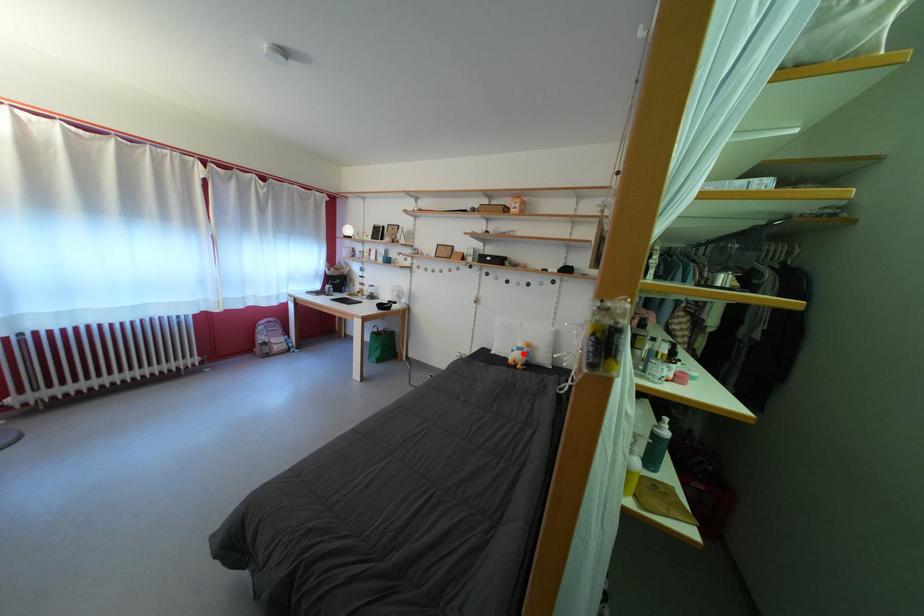
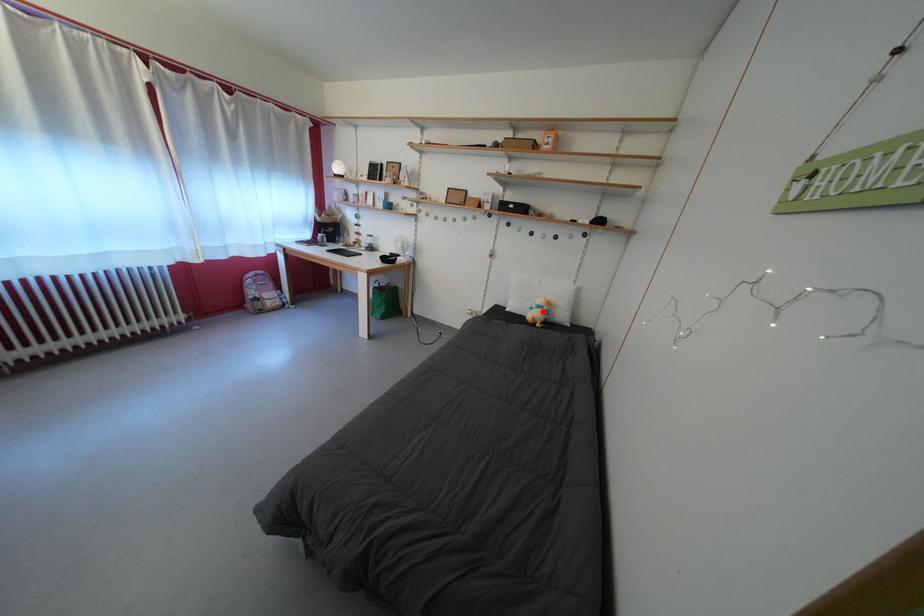
I am providing you with two images of the same scene from different viewpoints. A red point is marked on the first image and another point is marked on the second image. Is the marked point in image1 the same physical position as the marked point in image2?

Yes